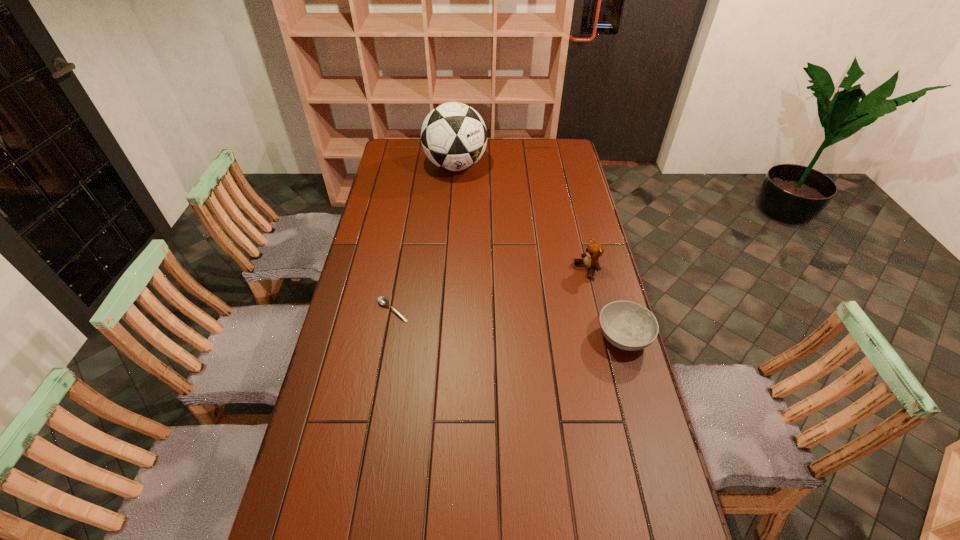
Identify the location of blank space at the right edge of the desktop. Image resolution: width=960 pixels, height=540 pixels. (576, 246).

What are the coordinates of `free spot at the near right corner of the desktop` in the screenshot? It's located at (614, 518).

Identify the location of free space between the tallest object and the bowl. This screenshot has width=960, height=540. (540, 251).

Image resolution: width=960 pixels, height=540 pixels. I want to click on free space between the soupspoon and the second shortest object, so click(x=508, y=323).

This screenshot has width=960, height=540. I want to click on free space that is in between the third shortest object and the soccer ball, so 521,218.

Find the location of `vacant space that's between the bowl and the farthest object`. vacant space that's between the bowl and the farthest object is located at coordinates (540, 251).

You are a GUI agent. You are given a task and a screenshot of the screen. Output one action in this format:
    pyautogui.click(x=<x>, y=<y>)
    Task: Click on the free space between the bowl and the tallest object
    The height and width of the screenshot is (540, 960).
    Given the screenshot: What is the action you would take?
    pyautogui.click(x=540, y=251)

The image size is (960, 540). In order to click on empty space between the farthest object and the soupspoon in this screenshot , I will do `click(424, 238)`.

The height and width of the screenshot is (540, 960). What are the coordinates of `free space between the second farthest object and the soupspoon` in the screenshot? It's located at (490, 290).

This screenshot has height=540, width=960. In order to click on free space between the soupspoon and the third tallest object in this screenshot , I will do `click(508, 323)`.